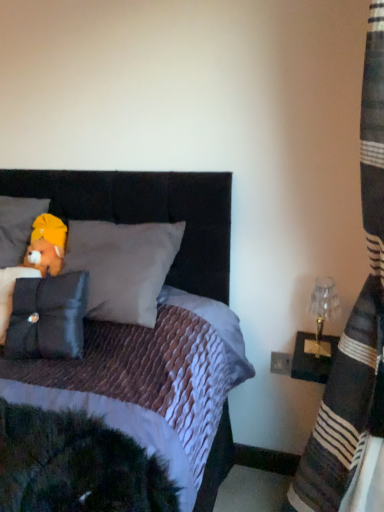
The width and height of the screenshot is (384, 512). I want to click on brown plush bear at upper left, so click(47, 245).

Identify the location of striped fabric curtain at right. Image resolution: width=384 pixels, height=512 pixels. (354, 325).

Looking at this image, what is the approximate width of black velvet pillow at left, which is the 2th pillow from back to front?

The width of black velvet pillow at left, which is the 2th pillow from back to front, is 8.58 inches.

Describe the element at coordinates (322, 314) in the screenshot. I see `clear glass lampshade at right` at that location.

Where is `velvet black headboard at upper center`? The height and width of the screenshot is (512, 384). velvet black headboard at upper center is located at coordinates (147, 213).

Identify the location of soft gray pillow at upper left, the 2th pillow ordered from the bottom. The width and height of the screenshot is (384, 512). (17, 227).

Does velvet black headboard at upper center lie behind striped fabric curtain at right?

Yes.

Between velvet black headboard at upper center and striped fabric curtain at right, which one has larger size?

Bigger between the two is striped fabric curtain at right.

From the image's perspective, is velvet black headboard at upper center located above or below striped fabric curtain at right?

Clearly, from the image's perspective, velvet black headboard at upper center is above striped fabric curtain at right.

Does point (212, 234) lie behind point (335, 450)?

Yes, it is.

Considering the positions of objects soft gray pillow at upper left, placed as the 1th pillow when sorted from top to bottom, and brown plush bear at upper left in the image provided, who is more to the left, soft gray pillow at upper left, placed as the 1th pillow when sorted from top to bottom, or brown plush bear at upper left?

Positioned to the left is soft gray pillow at upper left, placed as the 1th pillow when sorted from top to bottom.

I want to click on figurine located underneath the soft gray pillow at upper left, the 2th pillow ordered from the bottom (from a real-world perspective), so click(x=47, y=245).

Consider the image. From a real-world perspective, is soft gray pillow at upper left, which is the 2th pillow from front to back, physically below brown plush bear at upper left?

No, from a real-world perspective, soft gray pillow at upper left, which is the 2th pillow from front to back, is not under brown plush bear at upper left.

How much distance is there between soft gray pillow at upper left, the 2th pillow ordered from the bottom, and brown plush bear at upper left?

They are 3.20 inches apart.

Is clear glass lampshade at right positioned with its back to brown plush bear at upper left?

clear glass lampshade at right does not have its back to brown plush bear at upper left.

Locate an element on the screen. Image resolution: width=384 pixels, height=512 pixels. table lamp in front of the brown plush bear at upper left is located at coordinates (322, 314).

Is clear glass lampshade at right thinner than brown plush bear at upper left?

Yes, clear glass lampshade at right is thinner than brown plush bear at upper left.

Considering their positions, is clear glass lampshade at right located in front of or behind brown plush bear at upper left?

In the image, clear glass lampshade at right appears in front of brown plush bear at upper left.

Is striped fabric curtain at right directly adjacent to velvet black headboard at upper center?

No, striped fabric curtain at right is not next to velvet black headboard at upper center.

Is striped fabric curtain at right looking in the opposite direction of velvet black headboard at upper center?

No, velvet black headboard at upper center is not at the back of striped fabric curtain at right.

In order to click on headboard behind the striped fabric curtain at right in this screenshot , I will do `click(147, 213)`.

Between striped fabric curtain at right and velvet black headboard at upper center, which one is positioned in front?

striped fabric curtain at right is in front.

Is soft gray pillow at upper left, which is the 2th pillow from front to back, at the back of clear glass lampshade at right?

No, clear glass lampshade at right is not facing away from soft gray pillow at upper left, which is the 2th pillow from front to back.

Is clear glass lampshade at right taller or shorter than soft gray pillow at upper left, which is the 2th pillow from front to back?

In the image, clear glass lampshade at right appears to be shorter than soft gray pillow at upper left, which is the 2th pillow from front to back.

Which of these two, clear glass lampshade at right or soft gray pillow at upper left, which is the 2th pillow from front to back, is smaller?

clear glass lampshade at right is smaller.

From the image's perspective, which is below, clear glass lampshade at right or soft gray pillow at upper left, which is the 2th pillow from front to back?

From the image's view, clear glass lampshade at right is below.

Considering the sizes of clear glass lampshade at right and black velvet pillow at left, the first pillow viewed from the front, in the image, is clear glass lampshade at right taller or shorter than black velvet pillow at left, the first pillow viewed from the front,?

clear glass lampshade at right is shorter than black velvet pillow at left, the first pillow viewed from the front.

From the image's perspective, is clear glass lampshade at right above or below black velvet pillow at left, which appears as the 2th pillow when viewed from the top?

clear glass lampshade at right is situated lower than black velvet pillow at left, which appears as the 2th pillow when viewed from the top, in the image.

Are clear glass lampshade at right and black velvet pillow at left, which is the 2th pillow from back to front, located far from each other?

No.

From the picture: Considering the sizes of clear glass lampshade at right and black velvet pillow at left, which appears as the 2th pillow when viewed from the top, in the image, is clear glass lampshade at right bigger or smaller than black velvet pillow at left, which appears as the 2th pillow when viewed from the top,?

clear glass lampshade at right is smaller than black velvet pillow at left, which appears as the 2th pillow when viewed from the top.

Does striped fabric curtain at right have a larger size compared to soft gray pillow at upper left, arranged as the 1th pillow when viewed from the back?

Yes.

Based on their positions, is striped fabric curtain at right located to the left or right of soft gray pillow at upper left, the 2th pillow ordered from the bottom?

Clearly, striped fabric curtain at right is on the right of soft gray pillow at upper left, the 2th pillow ordered from the bottom, in the image.

Can you confirm if striped fabric curtain at right is thinner than soft gray pillow at upper left, arranged as the 1th pillow when viewed from the back?

No, striped fabric curtain at right is not thinner than soft gray pillow at upper left, arranged as the 1th pillow when viewed from the back.

You are a GUI agent. You are given a task and a screenshot of the screen. Output one action in this format:
    pyautogui.click(x=<x>, y=<y>)
    Task: Click on the headboard behind the striped fabric curtain at right
    The width and height of the screenshot is (384, 512).
    Given the screenshot: What is the action you would take?
    pyautogui.click(x=147, y=213)

Locate an element on the screen. The image size is (384, 512). figurine lying on the right of soft gray pillow at upper left, which is the 2th pillow from front to back is located at coordinates (47, 245).

Estimate the real-world distances between objects in this image. Which object is further from brown plush bear at upper left, striped fabric curtain at right or velvet black headboard at upper center?

striped fabric curtain at right.

Which object lies further to the anchor point velvet black headboard at upper center, brown plush bear at upper left or soft gray pillow at upper left, which is the 2th pillow from front to back?

Among the two, soft gray pillow at upper left, which is the 2th pillow from front to back, is located further to velvet black headboard at upper center.

When comparing their distances from black velvet pillow at left, which appears as the 2th pillow when viewed from the top, does velvet black headboard at upper center or clear glass lampshade at right seem further?

clear glass lampshade at right lies further to black velvet pillow at left, which appears as the 2th pillow when viewed from the top, than the other object.

Based on their spatial positions, is striped fabric curtain at right or brown plush bear at upper left further from black velvet pillow at left, which appears as the 2th pillow when viewed from the top?

striped fabric curtain at right is positioned further to the anchor black velvet pillow at left, which appears as the 2th pillow when viewed from the top.

Looking at the image, which one is located further to velvet black headboard at upper center, black velvet pillow at left, which is the 2th pillow from back to front, or striped fabric curtain at right?

striped fabric curtain at right.

From the image, which object appears to be nearer to soft gray pillow at upper left, the 2th pillow ordered from the bottom, brown plush bear at upper left or black velvet pillow at left, which appears as the 1th pillow when ordered from the bottom?

brown plush bear at upper left is closer to soft gray pillow at upper left, the 2th pillow ordered from the bottom.

Estimate the real-world distances between objects in this image. Which object is closer to brown plush bear at upper left, black velvet pillow at left, which appears as the 2th pillow when viewed from the top, or clear glass lampshade at right?

Among the two, black velvet pillow at left, which appears as the 2th pillow when viewed from the top, is located nearer to brown plush bear at upper left.

From the image, which object appears to be farther from striped fabric curtain at right, black velvet pillow at left, which appears as the 1th pillow when ordered from the bottom, or brown plush bear at upper left?

Based on the image, brown plush bear at upper left appears to be further to striped fabric curtain at right.

Identify the location of pillow between brown plush bear at upper left and clear glass lampshade at right from left to right. (48, 317).

The image size is (384, 512). I want to click on figurine between soft gray pillow at upper left, which is the 2th pillow from front to back, and velvet black headboard at upper center, so (47, 245).

Find the location of a particular element. This screenshot has width=384, height=512. curtain between black velvet pillow at left, which appears as the 1th pillow when ordered from the bottom, and clear glass lampshade at right, in the horizontal direction is located at coordinates (354, 325).

Where is `headboard situated between brown plush bear at upper left and striped fabric curtain at right from left to right`? The width and height of the screenshot is (384, 512). headboard situated between brown plush bear at upper left and striped fabric curtain at right from left to right is located at coordinates (x=147, y=213).